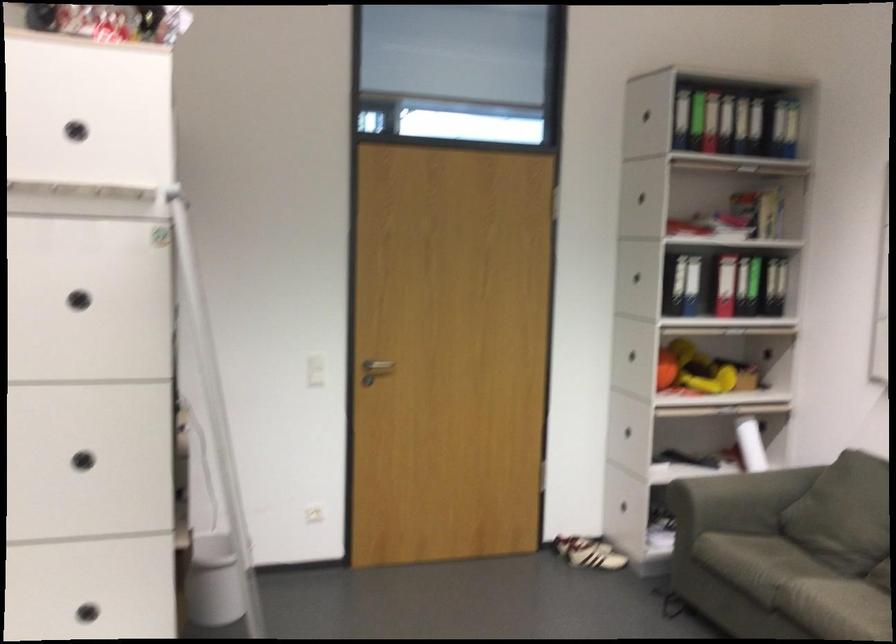
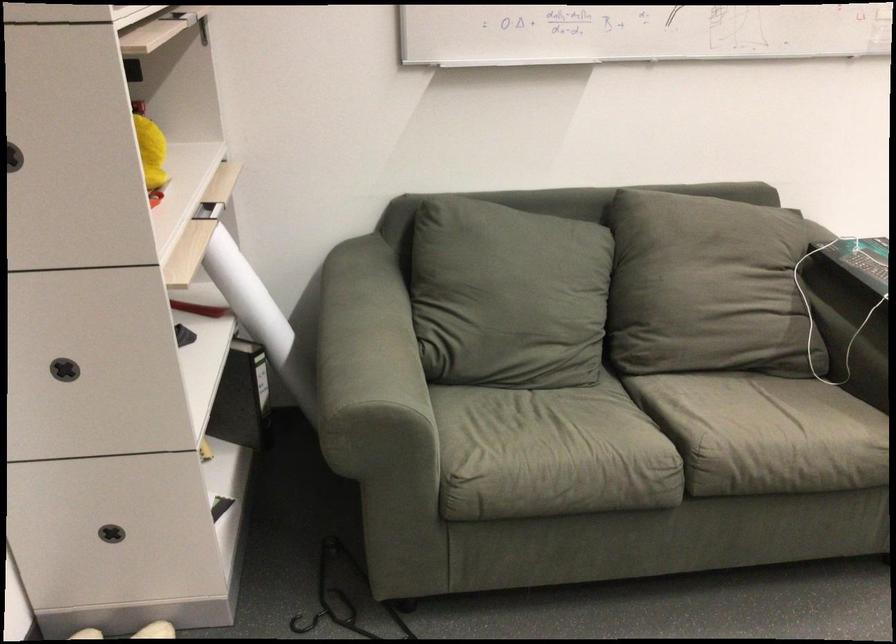
Where in the second image is the point corresponding to [746,458] from the first image?

(247, 296)